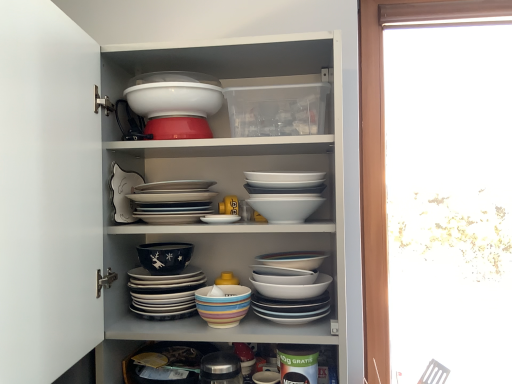
What do you see at coordinates (174, 99) in the screenshot? The height and width of the screenshot is (384, 512). I see `white glossy bowl at upper center, acting as the eighth bowl starting from the bottom` at bounding box center [174, 99].

Locate an element on the screen. Image resolution: width=512 pixels, height=384 pixels. matte red bowl at upper center, marked as the 2th bowl in a top-to-bottom arrangement is located at coordinates (177, 128).

Where is `white glossy bowls at center, which is the sixth bowl in bottom-to-top order`? The width and height of the screenshot is (512, 384). white glossy bowls at center, which is the sixth bowl in bottom-to-top order is located at coordinates (285, 194).

Where is `multicolored ceramic bowl at center, the eighth bowl viewed from the top`? This screenshot has height=384, width=512. multicolored ceramic bowl at center, the eighth bowl viewed from the top is located at coordinates (223, 305).

Identify the location of multicolored ceramic bowl at center, marked as the 2th bowl in a bottom-to-top arrangement. (165, 294).

Based on the photo, which point is more distant from viewer, (x=197, y=291) or (x=302, y=221)?

The point (x=197, y=291) is farther from the camera.

This screenshot has height=384, width=512. In order to click on bowl in front of the multicolored ceramic bowl at center, the eighth bowl viewed from the top in this screenshot , I will do click(x=285, y=194).

Can you confirm if multicolored ceramic bowl at center, which ranks as the 1th bowl in bottom-to-top order, is positioned to the left of white glossy bowls at center, which is the sixth bowl in bottom-to-top order?

Yes, multicolored ceramic bowl at center, which ranks as the 1th bowl in bottom-to-top order, is to the left of white glossy bowls at center, which is the sixth bowl in bottom-to-top order.

In the scene shown: Do you think multicolored ceramic bowl at center, which ranks as the 1th bowl in bottom-to-top order, is within white glossy bowls at center, the third bowl positioned from the top, or outside of it?

multicolored ceramic bowl at center, which ranks as the 1th bowl in bottom-to-top order, lies outside white glossy bowls at center, the third bowl positioned from the top.

Is matte red bowl at upper center, which ranks as the seventh bowl in bottom-to-top order, located within multicolored ceramic bowl at center, the seventh bowl when ordered from top to bottom?

No, matte red bowl at upper center, which ranks as the seventh bowl in bottom-to-top order, is not a part of multicolored ceramic bowl at center, the seventh bowl when ordered from top to bottom.

From the image's perspective, is multicolored ceramic bowl at center, the seventh bowl when ordered from top to bottom, over matte red bowl at upper center, marked as the 2th bowl in a top-to-bottom arrangement?

No, from the image's perspective, multicolored ceramic bowl at center, the seventh bowl when ordered from top to bottom, is not over matte red bowl at upper center, marked as the 2th bowl in a top-to-bottom arrangement.

Is multicolored ceramic bowl at center, marked as the 2th bowl in a bottom-to-top arrangement, placed right next to matte red bowl at upper center, which ranks as the seventh bowl in bottom-to-top order?

They are not placed beside each other.

Measure the distance from multicolored ceramic bowl at center, the seventh bowl when ordered from top to bottom, to matte red bowl at upper center, which ranks as the seventh bowl in bottom-to-top order.

They are 40.15 centimeters apart.

Is white glossy bowls at upper center in front of or behind multicolored ceramic bowl at center, which ranks as the 1th bowl in bottom-to-top order, in the image?

In the image, white glossy bowls at upper center appears in front of multicolored ceramic bowl at center, which ranks as the 1th bowl in bottom-to-top order.

How many degrees apart are the facing directions of white glossy bowls at upper center and multicolored ceramic bowl at center, which ranks as the 1th bowl in bottom-to-top order?

They differ by 0.000228 degrees in their facing directions.

Is white glossy bowls at upper center completely or partially outside of multicolored ceramic bowl at center, which ranks as the 1th bowl in bottom-to-top order?

That's correct, white glossy bowls at upper center is outside of multicolored ceramic bowl at center, which ranks as the 1th bowl in bottom-to-top order.

Where is `cupboard in front of the multicolored ceramic bowl at center, the seventh bowl when ordered from top to bottom`? The width and height of the screenshot is (512, 384). cupboard in front of the multicolored ceramic bowl at center, the seventh bowl when ordered from top to bottom is located at coordinates (101, 155).

Considering the sizes of white glossy bowls at upper center and multicolored ceramic bowl at center, the seventh bowl when ordered from top to bottom, in the image, is white glossy bowls at upper center wider or thinner than multicolored ceramic bowl at center, the seventh bowl when ordered from top to bottom,?

white glossy bowls at upper center is wider than multicolored ceramic bowl at center, the seventh bowl when ordered from top to bottom.

From the picture: Could you measure the distance between white glossy bowls at upper center and multicolored ceramic bowl at center, marked as the 2th bowl in a bottom-to-top arrangement?

white glossy bowls at upper center and multicolored ceramic bowl at center, marked as the 2th bowl in a bottom-to-top arrangement, are 17.22 inches apart.

Considering the positions of objects multicolored ceramic bowl at center, the seventh bowl when ordered from top to bottom, and white glossy bowl at upper center, acting as the eighth bowl starting from the bottom, in the image provided, who is more to the right, multicolored ceramic bowl at center, the seventh bowl when ordered from top to bottom, or white glossy bowl at upper center, acting as the eighth bowl starting from the bottom,?

white glossy bowl at upper center, acting as the eighth bowl starting from the bottom.

From the image's perspective, which bowl is the 6th one above the multicolored ceramic bowl at center, marked as the 2th bowl in a bottom-to-top arrangement? Please provide its 2D coordinates.

[(174, 99)]

Which is correct: multicolored ceramic bowl at center, the seventh bowl when ordered from top to bottom, is inside white glossy bowl at upper center, acting as the first bowl starting from the top, or outside of it?

multicolored ceramic bowl at center, the seventh bowl when ordered from top to bottom, lies outside white glossy bowl at upper center, acting as the first bowl starting from the top.

Considering their positions, is multicolored ceramic bowl at center, marked as the 2th bowl in a bottom-to-top arrangement, located in front of or behind white glossy bowl at upper center, acting as the first bowl starting from the top?

In the image, multicolored ceramic bowl at center, marked as the 2th bowl in a bottom-to-top arrangement, appears behind white glossy bowl at upper center, acting as the first bowl starting from the top.

You are a GUI agent. You are given a task and a screenshot of the screen. Output one action in this format:
    pyautogui.click(x=<x>, y=<y>)
    Task: Click on the 2nd bowl in front of the white glossy plate at center, positioned as the fourth bowl in top-to-bottom order
    The width and height of the screenshot is (512, 384).
    Given the screenshot: What is the action you would take?
    point(290,288)

In the image, is white glossy plate at center, positioned as the fourth bowl in top-to-bottom order, positioned in front of or behind multicolored ceramic bowls at center, arranged as the 6th bowl when viewed from the top?

In the image, white glossy plate at center, positioned as the fourth bowl in top-to-bottom order, appears behind multicolored ceramic bowls at center, arranged as the 6th bowl when viewed from the top.

Would you say white glossy plate at center, positioned as the fourth bowl in top-to-bottom order, contains multicolored ceramic bowls at center, arranged as the 6th bowl when viewed from the top?

No, multicolored ceramic bowls at center, arranged as the 6th bowl when viewed from the top, is not a part of white glossy plate at center, positioned as the fourth bowl in top-to-bottom order.

Is white glossy plate at center, positioned as the fourth bowl in top-to-bottom order, smaller than multicolored ceramic bowls at center, which is the 3th bowl in bottom-to-top order?

Indeed, white glossy plate at center, positioned as the fourth bowl in top-to-bottom order, has a smaller size compared to multicolored ceramic bowls at center, which is the 3th bowl in bottom-to-top order.

Between matte black bowl at center, which is counted as the fourth bowl, starting from the bottom, and white glossy bowl at upper center, acting as the first bowl starting from the top, which one has larger size?

Bigger between the two is white glossy bowl at upper center, acting as the first bowl starting from the top.

Does point (159, 267) come behind point (148, 96)?

Yes, point (159, 267) is behind point (148, 96).

Where is `bowl that is the 3rd one when counting rightward from the matte black bowl at center, the 5th bowl when ordered from top to bottom`? This screenshot has height=384, width=512. bowl that is the 3rd one when counting rightward from the matte black bowl at center, the 5th bowl when ordered from top to bottom is located at coordinates [x=174, y=99].

Consider the image. From a real-world perspective, who is located lower, matte black bowl at center, the 5th bowl when ordered from top to bottom, or white glossy bowl at upper center, acting as the first bowl starting from the top?

matte black bowl at center, the 5th bowl when ordered from top to bottom.

Locate an element on the screen. bowl that is the 5th one when counting upward from the multicolored ceramic bowl at center, which ranks as the 1th bowl in bottom-to-top order (from the image's perspective) is located at coordinates (285, 194).

This screenshot has height=384, width=512. I want to click on bowl that is the 5th one above the multicolored ceramic bowl at center, the seventh bowl when ordered from top to bottom (from a real-world perspective), so (177, 128).

From the image, which object appears to be farther from white glossy bowl at upper center, acting as the first bowl starting from the top, white glossy plate at center, positioned as the fourth bowl in top-to-bottom order, or matte black bowl at center, which is counted as the fourth bowl, starting from the bottom?

Among the two, matte black bowl at center, which is counted as the fourth bowl, starting from the bottom, is located further to white glossy bowl at upper center, acting as the first bowl starting from the top.

Looking at the image, which one is located closer to multicolored ceramic bowl at center, the seventh bowl when ordered from top to bottom, multicolored ceramic bowls at center, which is the 3th bowl in bottom-to-top order, or multicolored ceramic bowl at center, the eighth bowl viewed from the top?

The object closer to multicolored ceramic bowl at center, the seventh bowl when ordered from top to bottom, is multicolored ceramic bowl at center, the eighth bowl viewed from the top.

Which object lies nearer to the anchor point matte black bowl at center, which is counted as the fourth bowl, starting from the bottom, white glossy bowl at upper center, acting as the first bowl starting from the top, or multicolored ceramic bowl at center, marked as the 2th bowl in a bottom-to-top arrangement?

multicolored ceramic bowl at center, marked as the 2th bowl in a bottom-to-top arrangement, is closer to matte black bowl at center, which is counted as the fourth bowl, starting from the bottom.

When comparing their distances from multicolored ceramic bowl at center, the eighth bowl viewed from the top, does white glossy plate at center, positioned as the fourth bowl in top-to-bottom order, or white glossy bowl at upper center, acting as the first bowl starting from the top, seem further?

The object further to multicolored ceramic bowl at center, the eighth bowl viewed from the top, is white glossy bowl at upper center, acting as the first bowl starting from the top.

Looking at the image, which one is located closer to matte black bowl at center, the 5th bowl when ordered from top to bottom, multicolored ceramic bowls at center, which is the 3th bowl in bottom-to-top order, or multicolored ceramic bowl at center, the eighth bowl viewed from the top?

multicolored ceramic bowl at center, the eighth bowl viewed from the top, is positioned closer to the anchor matte black bowl at center, the 5th bowl when ordered from top to bottom.

Considering their positions, is multicolored ceramic bowls at center, which is the 3th bowl in bottom-to-top order, positioned closer to multicolored ceramic bowl at center, the seventh bowl when ordered from top to bottom, than matte red bowl at upper center, marked as the 2th bowl in a top-to-bottom arrangement?

multicolored ceramic bowls at center, which is the 3th bowl in bottom-to-top order, is closer to multicolored ceramic bowl at center, the seventh bowl when ordered from top to bottom.

From the image, which object appears to be farther from white glossy bowls at center, which is the sixth bowl in bottom-to-top order, multicolored ceramic bowl at center, the seventh bowl when ordered from top to bottom, or multicolored ceramic bowls at center, which is the 3th bowl in bottom-to-top order?

multicolored ceramic bowl at center, the seventh bowl when ordered from top to bottom, is further to white glossy bowls at center, which is the sixth bowl in bottom-to-top order.

Estimate the real-world distances between objects in this image. Which object is closer to white glossy bowl at upper center, acting as the first bowl starting from the top, matte black bowl at center, which is counted as the fourth bowl, starting from the bottom, or white glossy bowls at upper center?

white glossy bowls at upper center lies closer to white glossy bowl at upper center, acting as the first bowl starting from the top, than the other object.

The width and height of the screenshot is (512, 384). Find the location of `bowl between white glossy bowls at upper center and multicolored ceramic bowl at center, which ranks as the 1th bowl in bottom-to-top order, from front to back`. bowl between white glossy bowls at upper center and multicolored ceramic bowl at center, which ranks as the 1th bowl in bottom-to-top order, from front to back is located at coordinates (285, 194).